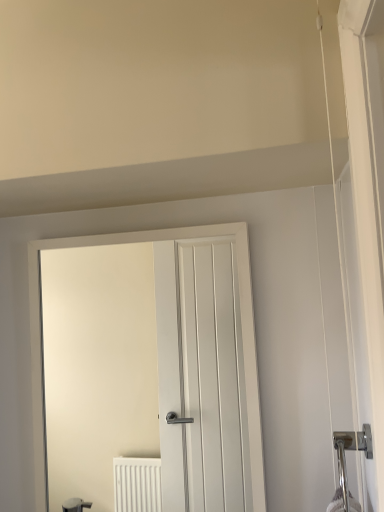
Question: Choose the correct answer: Is polished chrome door handle at right inside white matte door at center or outside it?

Choices:
 (A) outside
 (B) inside

Answer: (A)

Question: Is point (357, 437) closer or farther from the camera than point (33, 390)?

Choices:
 (A) farther
 (B) closer

Answer: (B)

Question: From their relative heights in the image, would you say polished chrome door handle at right is taller or shorter than white matte door at center?

Choices:
 (A) short
 (B) tall

Answer: (A)

Question: Is point (36, 287) closer or farther from the camera than point (344, 472)?

Choices:
 (A) farther
 (B) closer

Answer: (A)

Question: Looking at their shapes, would you say white matte door at center is wider or thinner than polished chrome door handle at right?

Choices:
 (A) wide
 (B) thin

Answer: (B)

Question: From their relative heights in the image, would you say white matte door at center is taller or shorter than polished chrome door handle at right?

Choices:
 (A) tall
 (B) short

Answer: (A)

Question: From a real-world perspective, is white matte door at center above or below polished chrome door handle at right?

Choices:
 (A) above
 (B) below

Answer: (A)